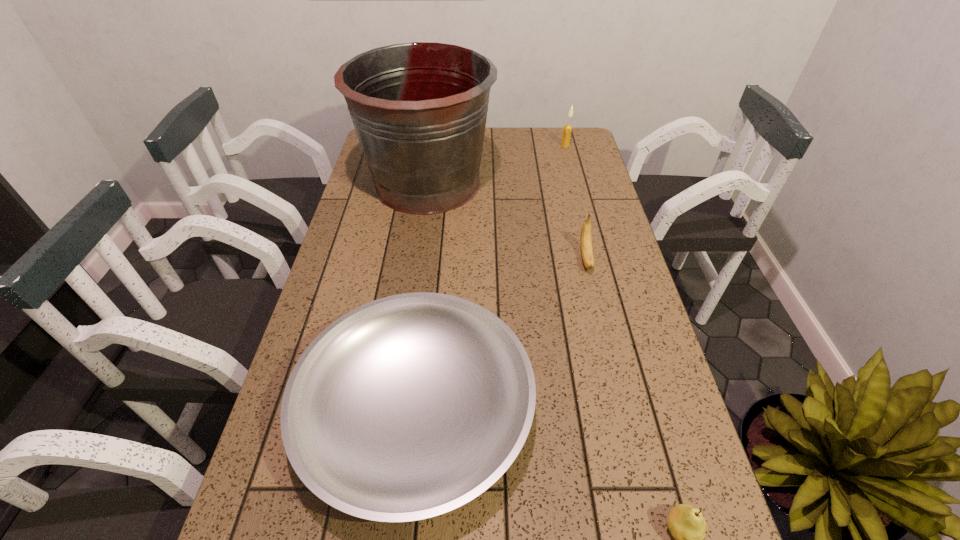
This screenshot has height=540, width=960. In the image, there is a desktop. In order to click on vacant space at the far right corner in this screenshot , I will do (x=557, y=137).

Identify the location of free space between the candle and the bedpan. The image size is (960, 540). (491, 277).

Identify the location of free space between the banana and the bucket. (507, 221).

Locate an element on the screen. The width and height of the screenshot is (960, 540). vacant point located between the candle and the bedpan is located at coordinates (491, 277).

I want to click on unoccupied position between the candle and the tallest object, so tap(496, 164).

Locate an element on the screen. This screenshot has width=960, height=540. free space between the fourth shortest object and the third tallest object is located at coordinates (576, 202).

What are the coordinates of `object that can be found as the fourth closest to the banana` in the screenshot? It's located at (687, 525).

Choose which object is the fourth nearest neighbor to the third shortest object. Please provide its 2D coordinates. Your answer should be formatted as a tuple, i.e. [(x, y)], where the tuple contains the x and y coordinates of a point satisfying the conditions above.

[(687, 525)]